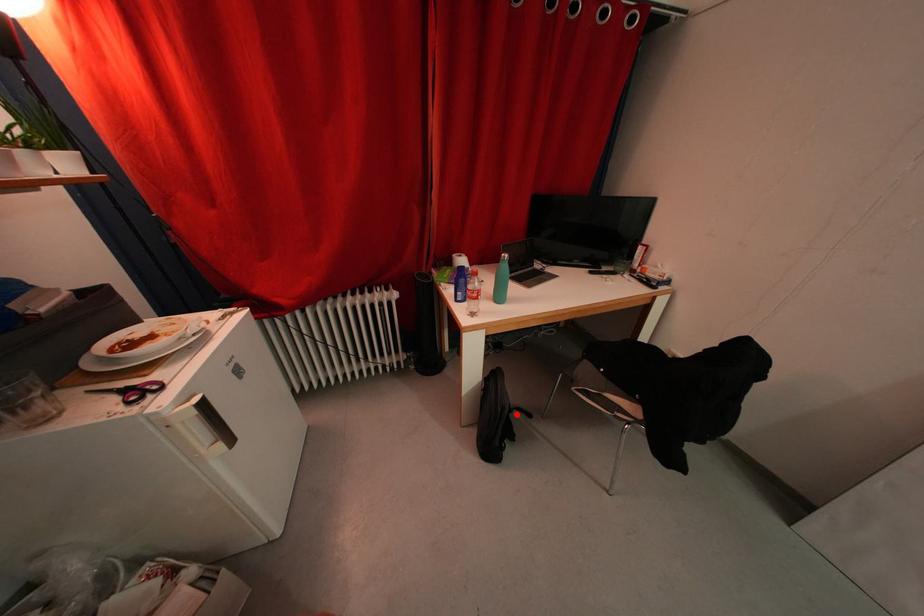
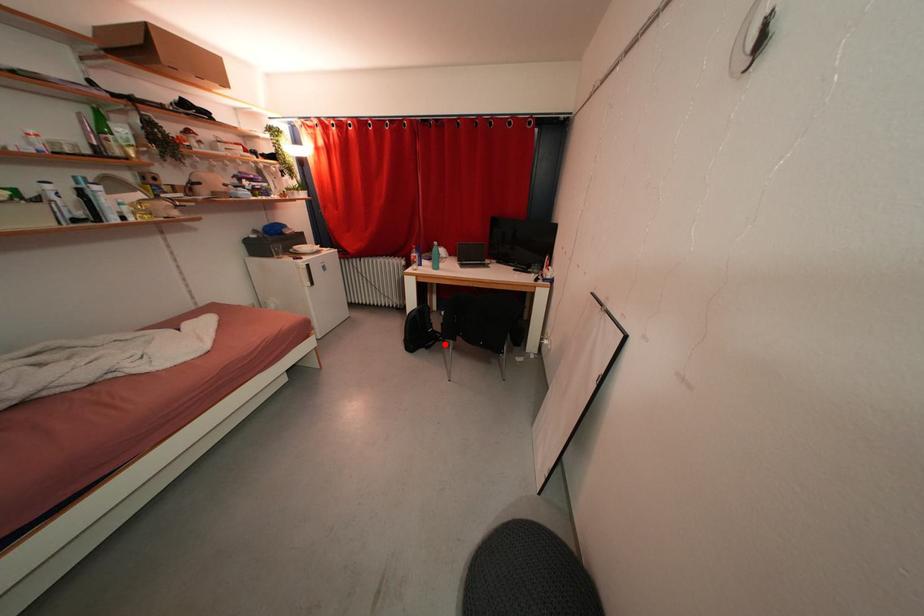
I am providing you with two images of the same scene from different viewpoints. A red point is marked on the first image and another point is marked on the second image. Is the red point in image1 aligned with the point shown in image2?

Yes